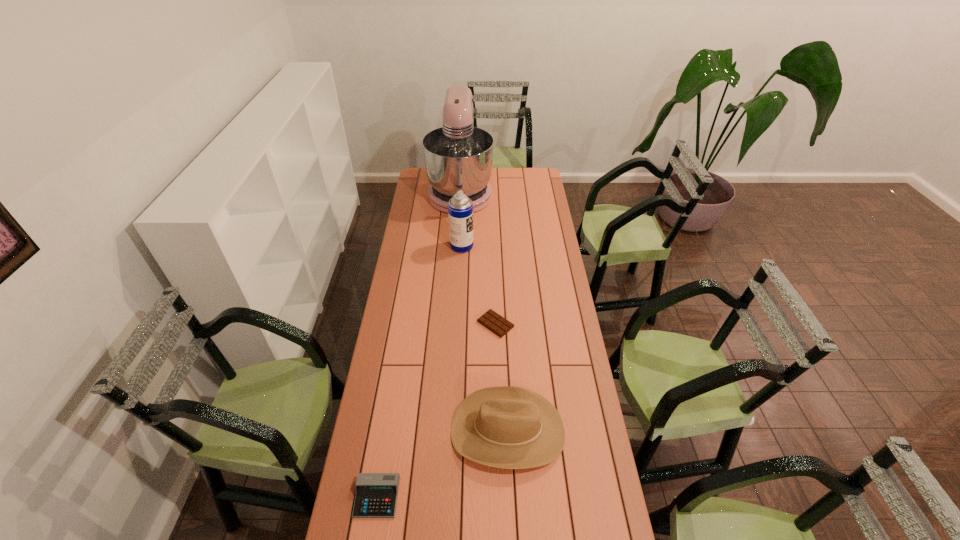
Where is `free space located 0.270m on the front-facing side of the farthest object`? free space located 0.270m on the front-facing side of the farthest object is located at coordinates (457, 251).

Locate an element on the screen. The height and width of the screenshot is (540, 960). free space located 0.350m on the label side of the fourth nearest object is located at coordinates (541, 246).

Identify the location of vacant space positioned 0.290m on the back of the cowboy hat. The image size is (960, 540). (503, 332).

Identify the location of vacant space located on the right of the second shortest object. (498, 497).

Where is `free space located on the front of the candy bar`? Image resolution: width=960 pixels, height=540 pixels. free space located on the front of the candy bar is located at coordinates (498, 398).

Find the location of a particular element. Image resolution: width=960 pixels, height=540 pixels. object that is positioned at the far edge is located at coordinates (458, 156).

In order to click on mixer present at the left edge in this screenshot , I will do `click(458, 156)`.

Find the location of a particular element. The width and height of the screenshot is (960, 540). calculator that is at the left edge is located at coordinates (376, 495).

You are a GUI agent. You are given a task and a screenshot of the screen. Output one action in this format:
    pyautogui.click(x=<x>, y=<y>)
    Task: Click on the object located in the right edge section of the desktop
    
    Given the screenshot: What is the action you would take?
    pyautogui.click(x=509, y=427)

Locate an element on the screen. object that is at the far left corner is located at coordinates (458, 156).